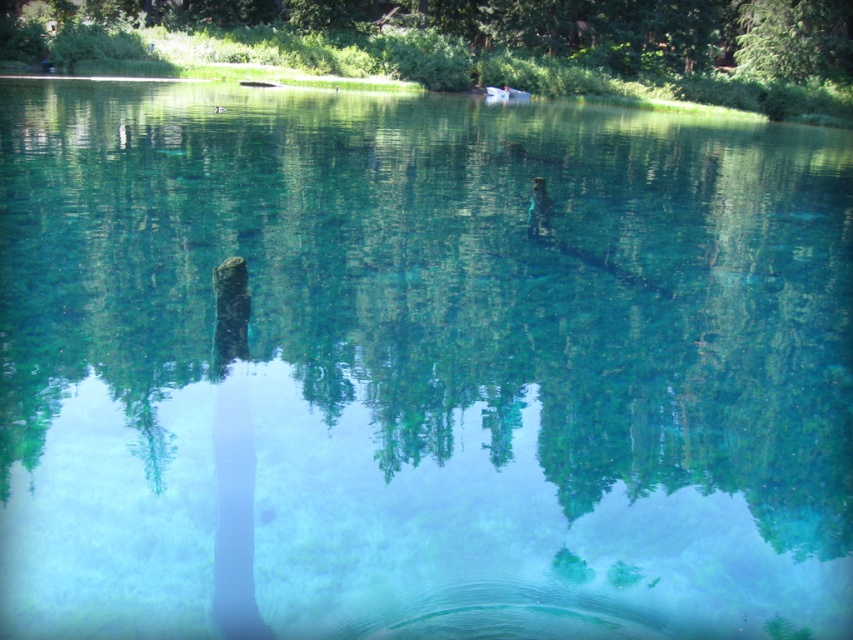
Looking at the serene lake scene, you notice two trees in the upper part of the image. The first is a green matte tree at upper center, and the second is a green leafy tree at upper right. Which of these two trees is positioned more to the right side of the image?

The green leafy tree at upper right is positioned more to the right side of the image compared to the green matte tree at upper center, which is to its left.

You are standing on the lakeside and see the black matte tree trunk at center and the green leafy tree at upper right. Which object is taller?

The green leafy tree at upper right is taller than the black matte tree trunk at center.